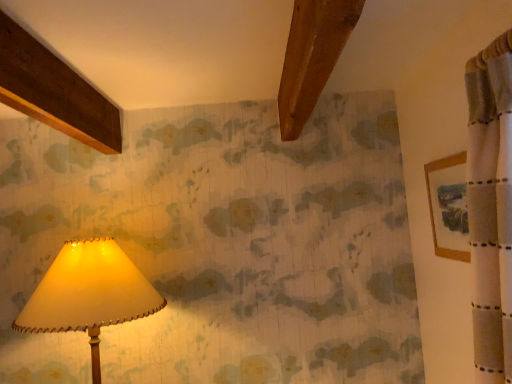
Question: Considering the positions of wooden framed picture at right and matte cream lampshade at lower left in the image, is wooden framed picture at right bigger or smaller than matte cream lampshade at lower left?

Choices:
 (A) small
 (B) big

Answer: (A)

Question: Is wooden framed picture at right wider or thinner than matte cream lampshade at lower left?

Choices:
 (A) wide
 (B) thin

Answer: (B)

Question: Is wooden framed picture at right situated inside matte cream lampshade at lower left or outside?

Choices:
 (A) outside
 (B) inside

Answer: (A)

Question: Is matte cream lampshade at lower left bigger or smaller than wooden framed picture at right?

Choices:
 (A) small
 (B) big

Answer: (B)

Question: Is point (96, 329) closer or farther from the camera than point (435, 190)?

Choices:
 (A) closer
 (B) farther

Answer: (A)

Question: Is matte cream lampshade at lower left inside the boundaries of wooden framed picture at right, or outside?

Choices:
 (A) inside
 (B) outside

Answer: (B)

Question: In the image, is matte cream lampshade at lower left positioned in front of or behind wooden framed picture at right?

Choices:
 (A) front
 (B) behind

Answer: (B)